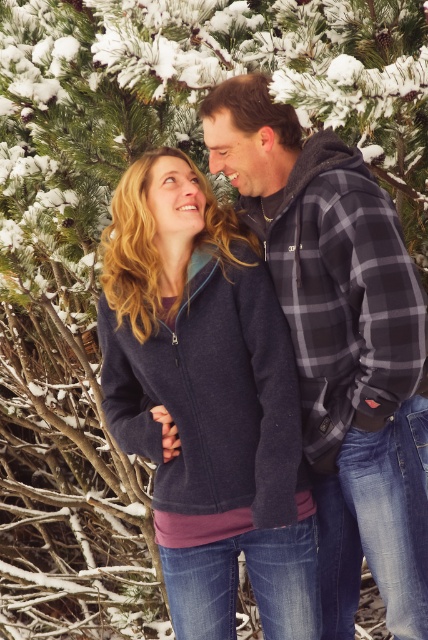
You are taking a photo of two people standing in front of snow covered pine branches. You notice two points in the image labeled as point (x=160, y=388) and point (x=231, y=145). Which point is closer to the camera?

Point (x=160, y=388) is closer to the camera than point (x=231, y=145).

You are a photographer trying to capture a close portrait of both the navy fleece jacket at center and the plaid flannel shirt at center. Your camera lens has a maximum focus range of 30 centimeters. Can you fit both items within the focus range without moving the camera?

The navy fleece jacket at center and plaid flannel shirt at center are 27.52 centimeters apart, which is within the camera lens maximum focus range of 30 centimeters. Yes, you can fit both items within the focus range without moving the camera.

You are a photographer standing 1.5 meters away from the camera. You want to take a photo of the navy fleece jacket at center. Can you reach the camera to adjust it without moving from your current position?

The distance between you and the camera is 1.5 meters, and the camera and the navy fleece jacket at center are 2.30 meters apart. Therefore, you are 3.8 meters away from the navy fleece jacket at center. Since you cannot stretch your arm that far, you need to move closer to adjust the camera.